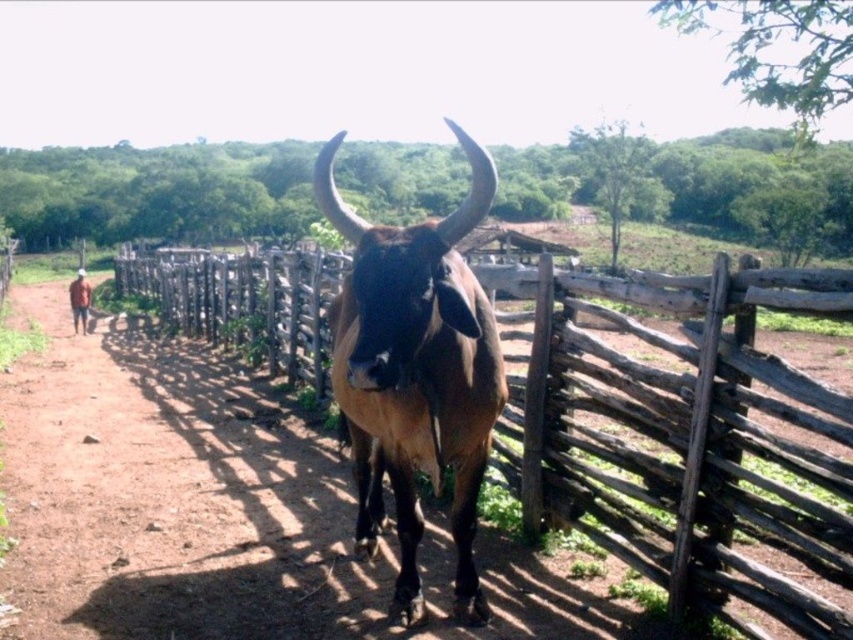
Question: Which point appears farthest from the camera in this image?

Choices:
 (A) (479, 412)
 (B) (708, 416)

Answer: (B)

Question: Among these points, which one is farthest from the camera?

Choices:
 (A) (277, 262)
 (B) (448, 288)

Answer: (A)

Question: Where is brown wooden fence at center located in relation to brown glossy bull at center in the image?

Choices:
 (A) above
 (B) below

Answer: (A)

Question: Does brown wooden fence at center appear under brown glossy bull at center?

Choices:
 (A) no
 (B) yes

Answer: (A)

Question: Where is brown wooden fence at center located in relation to brown glossy bull at center in the image?

Choices:
 (A) above
 (B) below

Answer: (A)